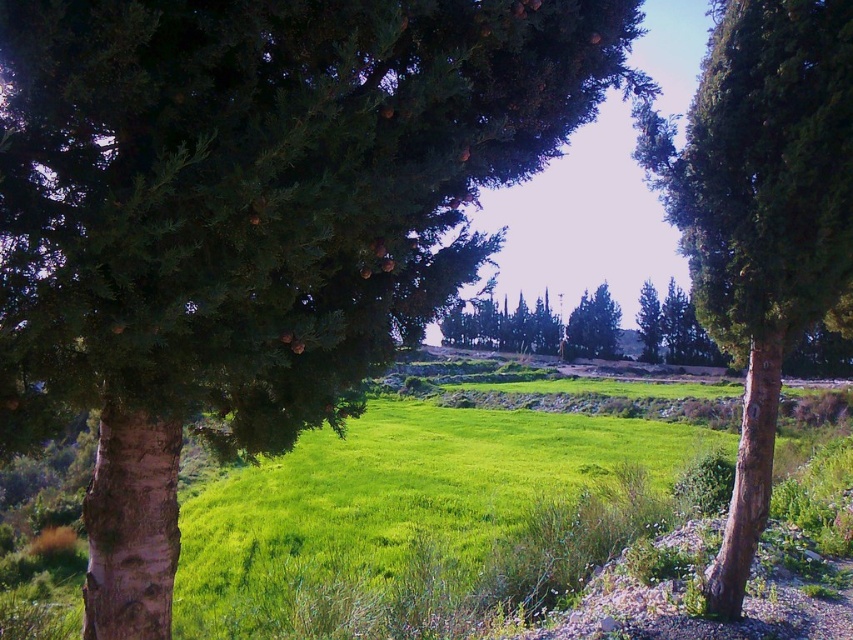
Is point (769, 173) positioned after point (651, 340)?

No, (769, 173) is in front of (651, 340).

Find the location of a particular element. Image resolution: width=853 pixels, height=640 pixels. green rough bark tree at right is located at coordinates (761, 218).

This screenshot has height=640, width=853. What are the coordinates of `green rough bark tree at right` in the screenshot? It's located at (761, 218).